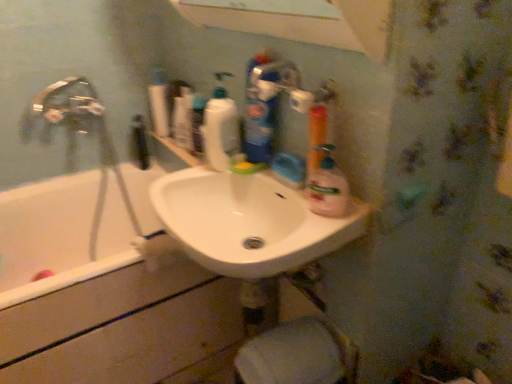
Describe the element at coordinates (220, 130) in the screenshot. I see `translucent plastic bottle at upper center, marked as the 2th cleaning product in a back-to-front arrangement` at that location.

How much space does translucent plastic bottle at upper center, marked as the 2th cleaning product in a back-to-front arrangement, occupy horizontally?

The width of translucent plastic bottle at upper center, marked as the 2th cleaning product in a back-to-front arrangement, is 2.69 inches.

Measure the distance between point [284,363] and camera.

Point [284,363] is 3.65 feet away from camera.

At what (x,y) coordinates should I click in order to perform the action: click on black glossy bottle at upper center. Please return your answer as a coordinate pair (x, y). Looking at the image, I should click on (139, 143).

Image resolution: width=512 pixels, height=384 pixels. I want to click on white glossy sink at center, so click(x=248, y=223).

Measure the distance between white glossy sink at center and camera.

white glossy sink at center and camera are 32.00 inches apart.

Where is `translucent plastic spray bottle at center, the fourth cleaning product when ordered from left to right`? translucent plastic spray bottle at center, the fourth cleaning product when ordered from left to right is located at coordinates (328, 187).

Identify the location of white glossy bathtub at left. (115, 323).

Identify the location of translucent plastic bottle at upper center, marked as the 2th cleaning product in a back-to-front arrangement. Image resolution: width=512 pixels, height=384 pixels. (220, 130).

Which is more to the right, white glossy sink at center or white matte toilet paper at lower center?

white matte toilet paper at lower center is more to the right.

Is white glossy sink at center looking in the opposite direction of white matte toilet paper at lower center?

That's not correct — white glossy sink at center is not looking away from white matte toilet paper at lower center.

Is white glossy sink at center inside or outside of white matte toilet paper at lower center?

The correct answer is: outside.

Who is bigger, white glossy sink at center or white matte toilet paper at lower center?

white glossy sink at center is bigger.

Which object is closer to the camera, white glossy bottle at upper center, which is the fourth cleaning product from front to back, or blue glossy bottle at upper center, which ranks as the 2th cleaning product in front-to-back order?

Positioned in front is blue glossy bottle at upper center, which ranks as the 2th cleaning product in front-to-back order.

In terms of height, does white glossy bottle at upper center, which is the first cleaning product from back to front, look taller or shorter compared to blue glossy bottle at upper center, acting as the 2th cleaning product starting from the right?

white glossy bottle at upper center, which is the first cleaning product from back to front, is shorter than blue glossy bottle at upper center, acting as the 2th cleaning product starting from the right.

Which of these two, white glossy bottle at upper center, which is the first cleaning product from back to front, or blue glossy bottle at upper center, which ranks as the 2th cleaning product in front-to-back order, is bigger?

blue glossy bottle at upper center, which ranks as the 2th cleaning product in front-to-back order, is bigger.

From a real-world perspective, which is physically above, white glossy bottle at upper center, the 1th cleaning product from the left, or blue glossy bottle at upper center, acting as the 2th cleaning product starting from the right?

From a 3D spatial view, blue glossy bottle at upper center, acting as the 2th cleaning product starting from the right, is above.

From a real-world perspective, which object stands above the other?

translucent plastic spray bottle at center, acting as the fourth cleaning product starting from the back.

Where is `the 3rd cleaning product in front of the white glossy bottle at upper center, the 1th cleaning product from the left`? Image resolution: width=512 pixels, height=384 pixels. the 3rd cleaning product in front of the white glossy bottle at upper center, the 1th cleaning product from the left is located at coordinates (328, 187).

Is white glossy bottle at upper center, which appears as the 4th cleaning product when viewed from the right, behind translucent plastic spray bottle at center, which is the first cleaning product in right-to-left order?

Yes, it is behind translucent plastic spray bottle at center, which is the first cleaning product in right-to-left order.

Is white glossy bottle at upper center, which is the fourth cleaning product from front to back, to the right of translucent plastic spray bottle at center, the fourth cleaning product when ordered from left to right, from the viewer's perspective?

Incorrect, white glossy bottle at upper center, which is the fourth cleaning product from front to back, is not on the right side of translucent plastic spray bottle at center, the fourth cleaning product when ordered from left to right.

Is white glossy sink at center to the left of translucent plastic spray bottle at center, the fourth cleaning product when ordered from left to right, from the viewer's perspective?

Correct, you'll find white glossy sink at center to the left of translucent plastic spray bottle at center, the fourth cleaning product when ordered from left to right.

Which object is further away from the camera taking this photo, white glossy sink at center or translucent plastic spray bottle at center, the fourth cleaning product when ordered from left to right?

translucent plastic spray bottle at center, the fourth cleaning product when ordered from left to right, is more distant.

Where is `sink that is under the translucent plastic spray bottle at center, which is the first cleaning product in right-to-left order (from a real-world perspective)`? sink that is under the translucent plastic spray bottle at center, which is the first cleaning product in right-to-left order (from a real-world perspective) is located at coordinates (248, 223).

From the image's perspective, relative to translucent plastic spray bottle at center, the fourth cleaning product when ordered from left to right, is white glossy sink at center above or below?

From the image's perspective, white glossy sink at center appears below translucent plastic spray bottle at center, the fourth cleaning product when ordered from left to right.

Is black glossy bottle at upper center far away from white glossy bathtub at left?

They are positioned close to each other.

Can you confirm if black glossy bottle at upper center is smaller than white glossy bathtub at left?

Indeed, black glossy bottle at upper center has a smaller size compared to white glossy bathtub at left.

Is black glossy bottle at upper center behind white glossy bathtub at left?

Yes, black glossy bottle at upper center is behind white glossy bathtub at left.

Is black glossy bottle at upper center not within white glossy bathtub at left?

black glossy bottle at upper center lies outside white glossy bathtub at left's area.

Is point (151, 116) less distant than point (42, 308)?

No.

Looking at this image, from a real-world perspective, which object stands above the other?

In real-world perspective, white glossy bottle at upper center, which is the first cleaning product from back to front, is above.

Considering the relative sizes of white glossy bottle at upper center, the 1th cleaning product from the left, and white glossy bathtub at left in the image provided, is white glossy bottle at upper center, the 1th cleaning product from the left, thinner than white glossy bathtub at left?

Correct, the width of white glossy bottle at upper center, the 1th cleaning product from the left, is less than that of white glossy bathtub at left.

How many degrees apart are the facing directions of white glossy bottle at upper center, the 1th cleaning product from the left, and white glossy bathtub at left?

120 degrees.

Is translucent plastic spray bottle at center, which is the first cleaning product in right-to-left order, wider than white glossy bathtub at left?

No, translucent plastic spray bottle at center, which is the first cleaning product in right-to-left order, is not wider than white glossy bathtub at left.

Considering the sizes of translucent plastic spray bottle at center, which is counted as the 1th cleaning product, starting from the front, and white glossy bathtub at left in the image, is translucent plastic spray bottle at center, which is counted as the 1th cleaning product, starting from the front, bigger or smaller than white glossy bathtub at left?

translucent plastic spray bottle at center, which is counted as the 1th cleaning product, starting from the front, is smaller than white glossy bathtub at left.

Is translucent plastic spray bottle at center, the fourth cleaning product when ordered from left to right, positioned far away from white glossy bathtub at left?

No, there isn't a large distance between translucent plastic spray bottle at center, the fourth cleaning product when ordered from left to right, and white glossy bathtub at left.

Would you say translucent plastic spray bottle at center, acting as the fourth cleaning product starting from the back, is inside or outside white glossy bathtub at left?

The correct answer is: outside.

The image size is (512, 384). I want to click on sink above the white matte toilet paper at lower center (from the image's perspective), so click(x=248, y=223).

You are a GUI agent. You are given a task and a screenshot of the screen. Output one action in this format:
    pyautogui.click(x=<x>, y=<y>)
    Task: Click on the cleaning product that is the 3rd object above the white glossy bottle at upper center, which appears as the 4th cleaning product when viewed from the right (from a real-world perspective)
    The image size is (512, 384).
    Given the screenshot: What is the action you would take?
    pyautogui.click(x=258, y=116)

When comparing their distances from white glossy bathtub at left, does black glossy bottle at upper center or white glossy bottle at upper center, which is the first cleaning product from back to front, seem further?

white glossy bottle at upper center, which is the first cleaning product from back to front, lies further to white glossy bathtub at left than the other object.

Estimate the real-world distances between objects in this image. Which object is further from white glossy bathtub at left, white glossy bottle at upper center, which is the fourth cleaning product from front to back, or white glossy sink at center?

white glossy bottle at upper center, which is the fourth cleaning product from front to back, is further to white glossy bathtub at left.

From the image, which object appears to be farther from translucent plastic bottle at upper center, arranged as the 3th cleaning product when viewed from the front, translucent plastic spray bottle at center, which is the first cleaning product in right-to-left order, or white matte toilet paper at lower center?

white matte toilet paper at lower center lies further to translucent plastic bottle at upper center, arranged as the 3th cleaning product when viewed from the front, than the other object.

When comparing their distances from translucent plastic spray bottle at center, which is the first cleaning product in right-to-left order, does blue glossy bottle at upper center, acting as the 2th cleaning product starting from the right, or white glossy bathtub at left seem further?

white glossy bathtub at left.

Estimate the real-world distances between objects in this image. Which object is closer to translucent plastic bottle at upper center, marked as the 2th cleaning product in a back-to-front arrangement, white glossy bathtub at left or white glossy bathtub at left?

white glossy bathtub at left.

Considering their positions, is white matte toilet paper at lower center positioned closer to white glossy sink at center than white glossy bathtub at left?

white matte toilet paper at lower center is positioned closer to the anchor white glossy sink at center.

Based on their spatial positions, is blue glossy bottle at upper center, placed as the third cleaning product when sorted from left to right, or translucent plastic bottle at upper center, marked as the 2th cleaning product in a back-to-front arrangement, closer to white glossy bathtub at left?

Among the two, translucent plastic bottle at upper center, marked as the 2th cleaning product in a back-to-front arrangement, is located nearer to white glossy bathtub at left.

Based on their spatial positions, is white glossy bottle at upper center, the 1th cleaning product from the left, or black glossy bottle at upper center further from white glossy bathtub at left?

white glossy bottle at upper center, the 1th cleaning product from the left, is positioned further to the anchor white glossy bathtub at left.

I want to click on bathtub that lies between black glossy bottle at upper center and white matte toilet paper at lower center from top to bottom, so click(x=60, y=235).

The width and height of the screenshot is (512, 384). I want to click on bath between translucent plastic bottle at upper center, marked as the 2th cleaning product in a back-to-front arrangement, and white matte toilet paper at lower center in the up-down direction, so click(115, 323).

The image size is (512, 384). I want to click on cleaning product positioned between white glossy bathtub at left and black glossy bottle at upper center from near to far, so click(x=159, y=102).

Find the location of a particular element. The image size is (512, 384). bath located between white glossy bathtub at left and white matte toilet paper at lower center in the left-right direction is located at coordinates (115, 323).